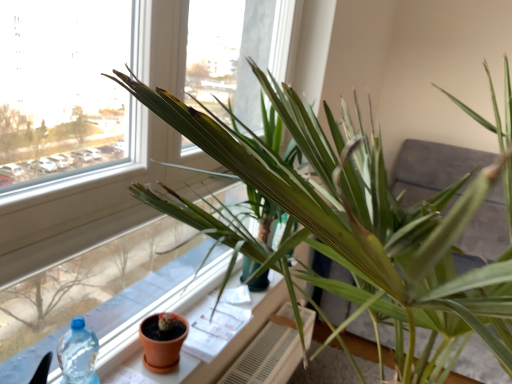
Question: Is terracotta clay pot at lower center at the back of white textured radiator at lower center?

Choices:
 (A) yes
 (B) no

Answer: (B)

Question: Is white textured radiator at lower center next to terracotta clay pot at lower center?

Choices:
 (A) no
 (B) yes

Answer: (A)

Question: Does white textured radiator at lower center have a larger size compared to terracotta clay pot at lower center?

Choices:
 (A) yes
 (B) no

Answer: (A)

Question: Can you confirm if white textured radiator at lower center is thinner than terracotta clay pot at lower center?

Choices:
 (A) no
 (B) yes

Answer: (A)

Question: Does white textured radiator at lower center appear on the right side of terracotta clay pot at lower center?

Choices:
 (A) yes
 (B) no

Answer: (A)

Question: From the image's perspective, is white textured radiator at lower center located beneath terracotta clay pot at lower center?

Choices:
 (A) no
 (B) yes

Answer: (B)

Question: Is green matte plant at center thinner than white textured radiator at lower center?

Choices:
 (A) yes
 (B) no

Answer: (B)

Question: Is green matte plant at center facing towards white textured radiator at lower center?

Choices:
 (A) yes
 (B) no

Answer: (B)

Question: Is green matte plant at center smaller than white textured radiator at lower center?

Choices:
 (A) yes
 (B) no

Answer: (B)

Question: Can you confirm if green matte plant at center is shorter than white textured radiator at lower center?

Choices:
 (A) yes
 (B) no

Answer: (B)

Question: Is green matte plant at center at the left side of white textured radiator at lower center?

Choices:
 (A) yes
 (B) no

Answer: (B)

Question: Considering the relative positions of green matte plant at center and white textured radiator at lower center in the image provided, is green matte plant at center to the right of white textured radiator at lower center from the viewer's perspective?

Choices:
 (A) no
 (B) yes

Answer: (B)

Question: From the image's perspective, does white textured radiator at lower center appear higher than terracotta clay pot at lower left?

Choices:
 (A) yes
 (B) no

Answer: (B)